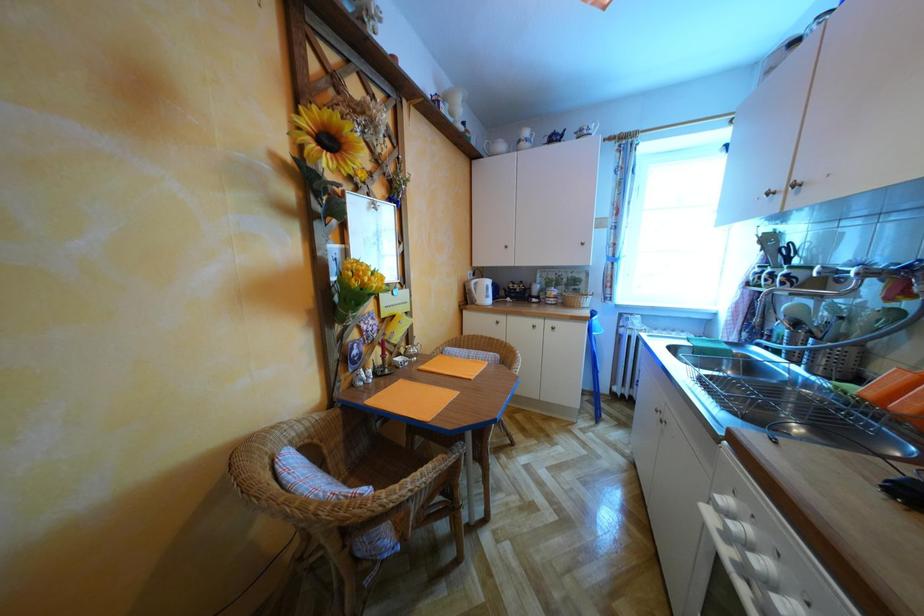
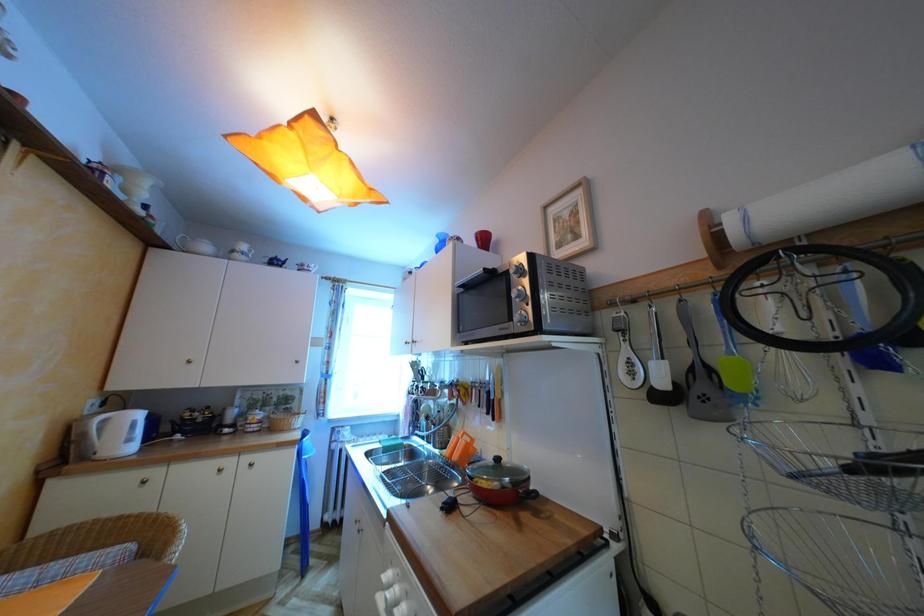
First-person continuous shooting, in which direction is the camera rotating?

The rotation direction of the camera is right-up.